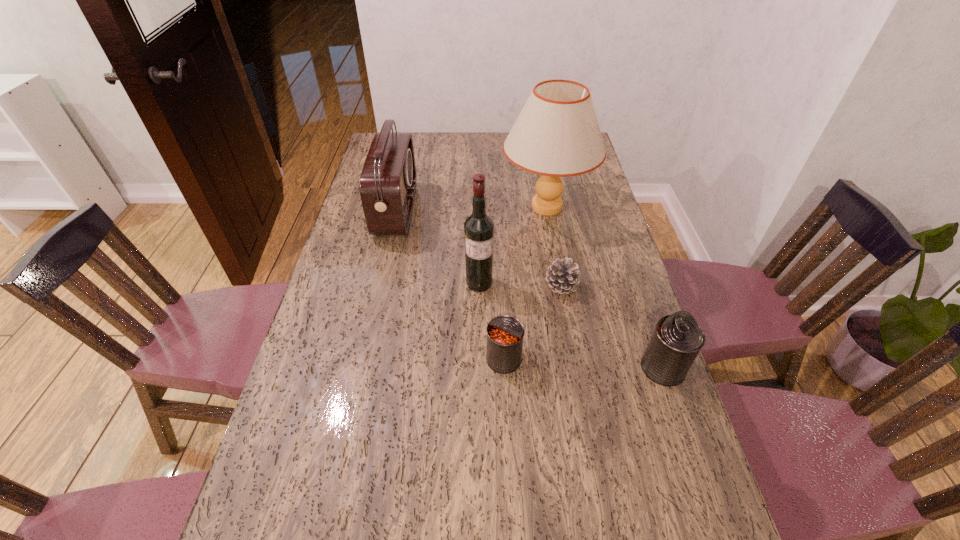
The image size is (960, 540). I want to click on object that ranks as the closest to the pinecone, so click(478, 228).

The width and height of the screenshot is (960, 540). Identify the location of free space in the image that satisfies the following two spatial constraints: 1. on the front and back of the left can; 2. on the left side of the wine bottle. (479, 359).

Where is `free space that satisfies the following two spatial constraints: 1. on the front and back of the wine bottle; 2. on the right side of the pinecone`? Image resolution: width=960 pixels, height=540 pixels. free space that satisfies the following two spatial constraints: 1. on the front and back of the wine bottle; 2. on the right side of the pinecone is located at coordinates (479, 286).